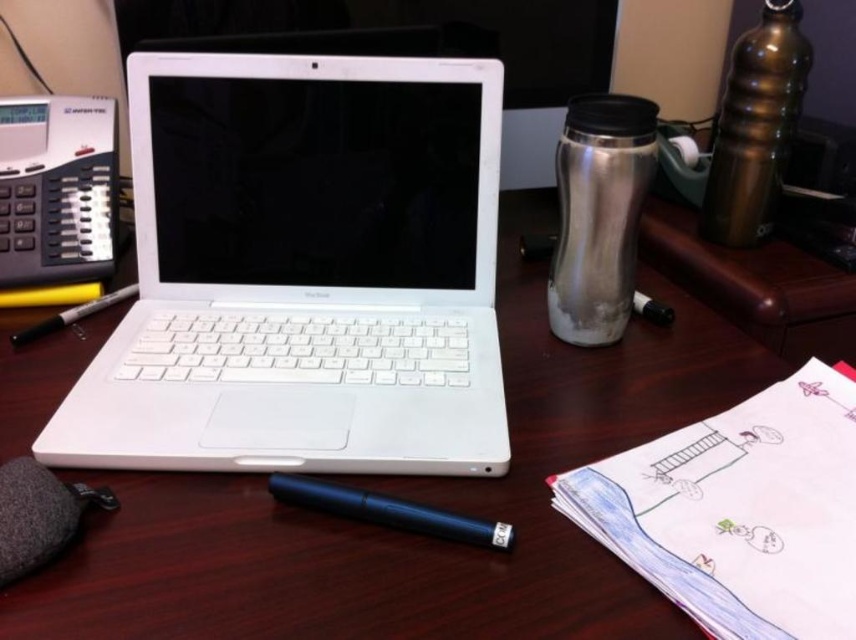
Question: Is black plastic phone at left below yellow matte marker at left?

Choices:
 (A) no
 (B) yes

Answer: (A)

Question: Which object is the closest to the wooden table at center?

Choices:
 (A) black plastic phone at left
 (B) black plastic pen at lower center
 (C) yellow matte marker at left

Answer: (B)

Question: Is white paper notepad at lower right positioned before yellow matte marker at left?

Choices:
 (A) yes
 (B) no

Answer: (A)

Question: Can you confirm if white paper notepad at lower right is positioned to the right of yellow matte marker at left?

Choices:
 (A) yes
 (B) no

Answer: (A)

Question: Which point appears farthest from the camera in this image?

Choices:
 (A) (290, 372)
 (B) (771, 556)
 (C) (331, 536)
 (D) (21, 106)

Answer: (D)

Question: Which of the following is the farthest from the observer?

Choices:
 (A) (86, 312)
 (B) (783, 442)
 (C) (361, 193)

Answer: (A)